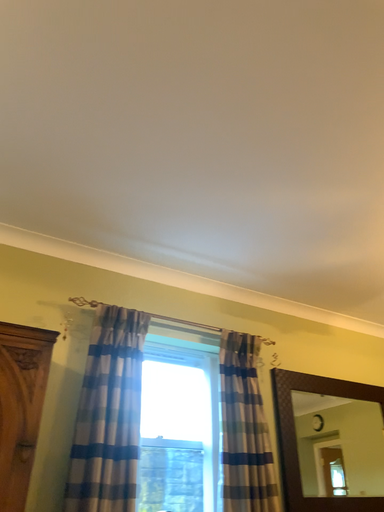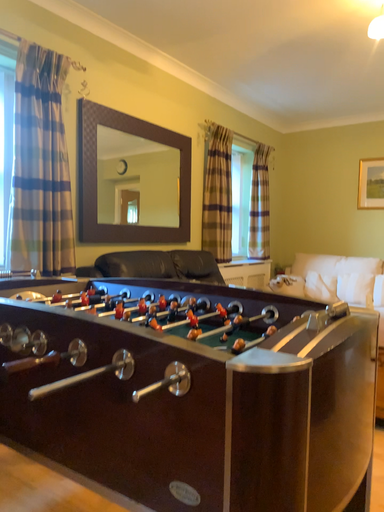
Question: How did the camera likely rotate when shooting the video?

Choices:
 (A) rotated upward
 (B) rotated downward

Answer: (B)